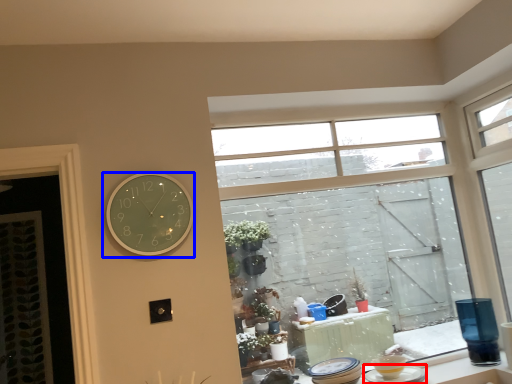
Question: Among these objects, which one is farthest to the camera, tableware (highlighted by a red box) or wall clock (highlighted by a blue box)?

Choices:
 (A) tableware
 (B) wall clock

Answer: (A)